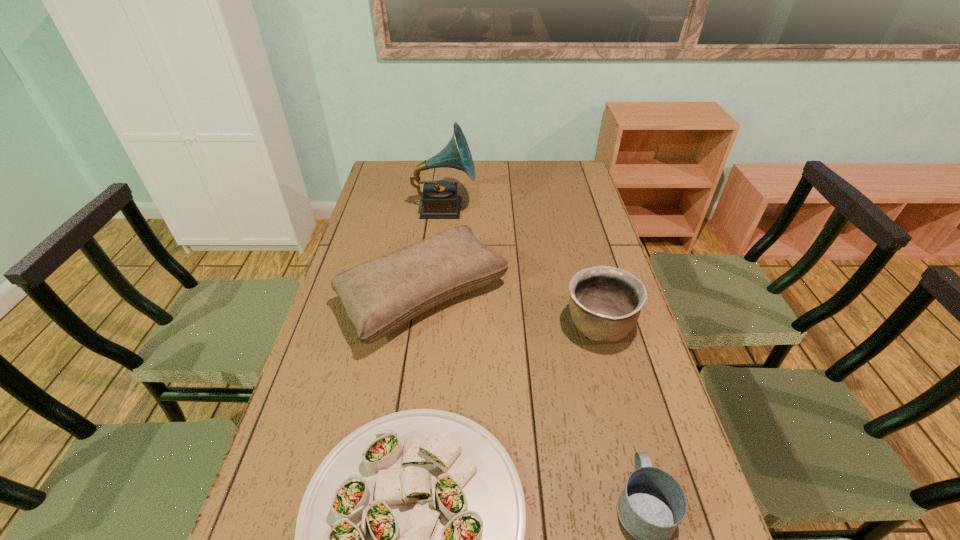
Locate an element on the screen. The image size is (960, 540). the farthest object is located at coordinates (439, 198).

Where is `phonograph_record`? The image size is (960, 540). phonograph_record is located at coordinates (439, 198).

Identify the location of cushion. (380, 295).

The width and height of the screenshot is (960, 540). What are the coordinates of `pottery` in the screenshot? It's located at (605, 302).

You are a GUI agent. You are given a task and a screenshot of the screen. Output one action in this format:
    pyautogui.click(x=<x>, y=<y>)
    Task: Click on the vacant space situated 0.130m from the horn of the farthest object
    Image resolution: width=960 pixels, height=540 pixels.
    Given the screenshot: What is the action you would take?
    pyautogui.click(x=509, y=208)

This screenshot has height=540, width=960. Identify the location of free space located on the back of the cushion. (437, 201).

The image size is (960, 540). Find the location of `free space located 0.340m on the front of the pottery`. free space located 0.340m on the front of the pottery is located at coordinates (639, 483).

At what (x,y) coordinates should I click in order to perform the action: click on object present at the left edge. Please return your answer as a coordinate pair (x, y). The height and width of the screenshot is (540, 960). Looking at the image, I should click on (380, 295).

The height and width of the screenshot is (540, 960). What are the coordinates of `object present at the right edge` in the screenshot? It's located at (605, 302).

Identify the location of vacant space at the far edge of the desktop. Image resolution: width=960 pixels, height=540 pixels. (430, 181).